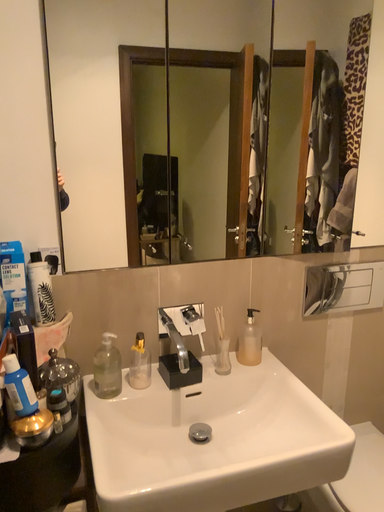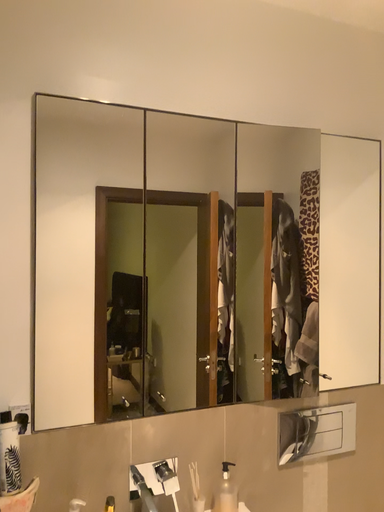
Question: How did the camera likely rotate when shooting the video?

Choices:
 (A) rotated downward
 (B) rotated upward

Answer: (B)